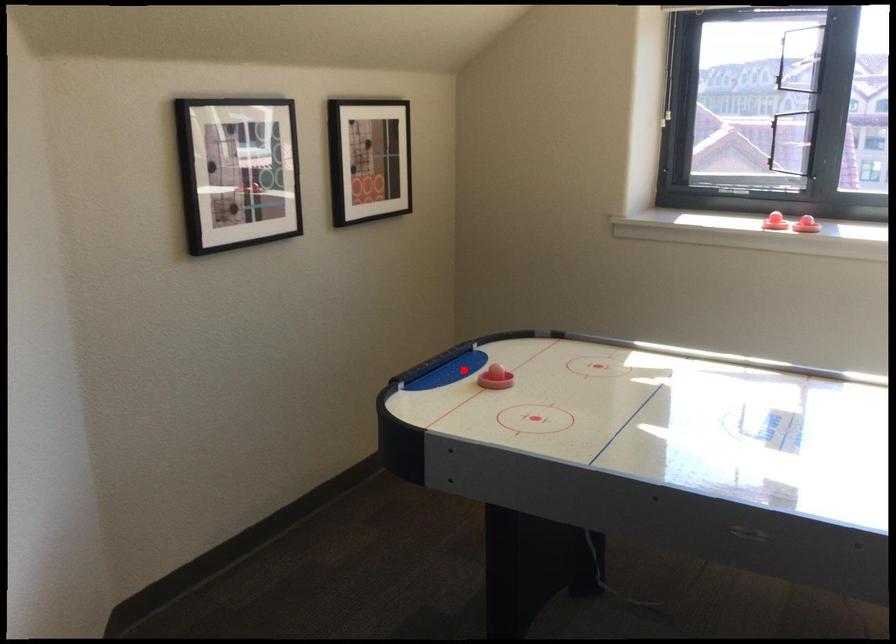
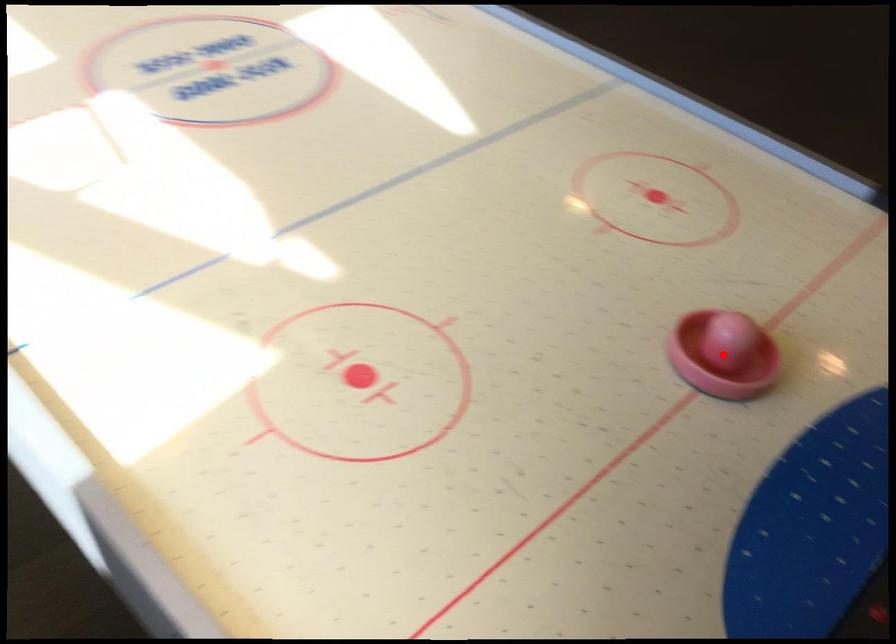
I am providing you with two images of the same scene from different viewpoints. A red point is marked on the first image and another point is marked on the second image. Are the points marked in image1 and image2 representing the same 3D position?

Yes